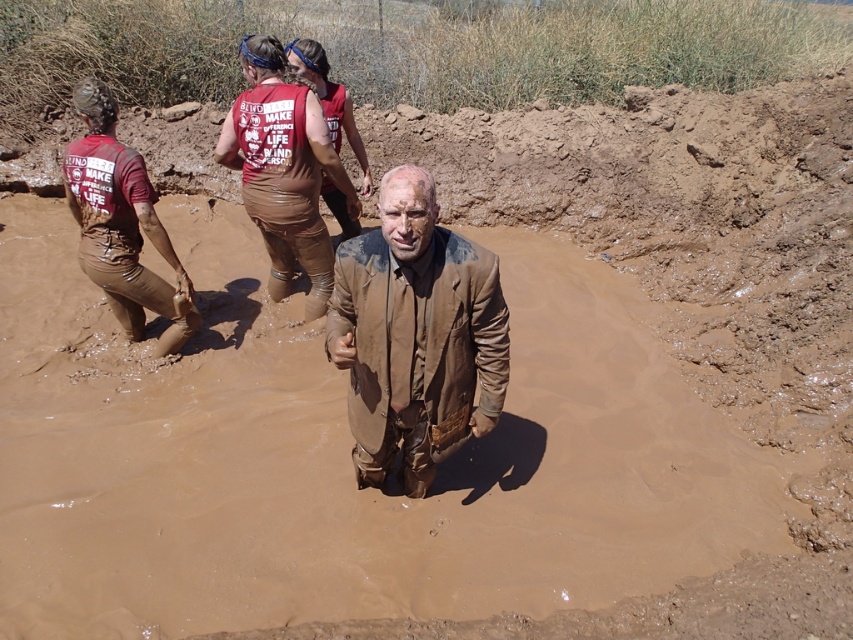
Question: Considering the relative positions of muddy brown suit at center and muddy brown pants at left in the image provided, where is muddy brown suit at center located with respect to muddy brown pants at left?

Choices:
 (A) below
 (B) above

Answer: (A)

Question: In this image, where is muddy brown suit at center located relative to muddy brown pants at left?

Choices:
 (A) right
 (B) left

Answer: (A)

Question: Which of the following is the closest to the observer?

Choices:
 (A) muddy brown suit at center
 (B) muddy brown pants at left

Answer: (A)

Question: Which point appears closest to the camera in this image?

Choices:
 (A) (376, 458)
 (B) (103, 128)
 (C) (306, 310)

Answer: (A)

Question: Among these points, which one is nearest to the camera?

Choices:
 (A) (231, 163)
 (B) (120, 301)
 (C) (480, 410)

Answer: (C)

Question: Does muddy brown suit at center have a smaller size compared to muddy brown pants at left?

Choices:
 (A) yes
 (B) no

Answer: (B)